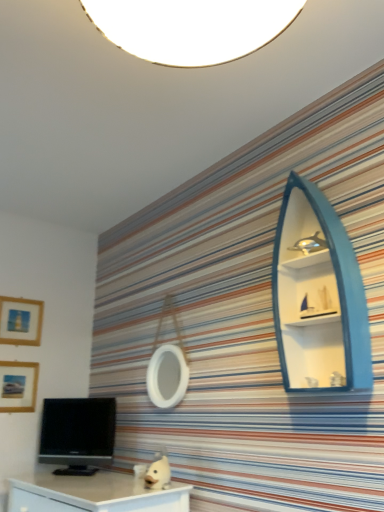
Question: Does wooden matte picture frame at lower left, the 1th picture frame when ordered from bottom to top, touch black glossy tv at lower left?

Choices:
 (A) yes
 (B) no

Answer: (B)

Question: From a real-world perspective, is wooden matte picture frame at lower left, which ranks as the 2th picture frame in top-to-bottom order, physically below black glossy tv at lower left?

Choices:
 (A) no
 (B) yes

Answer: (A)

Question: Is the depth of wooden matte picture frame at lower left, the 1th picture frame when ordered from bottom to top, less than that of black glossy tv at lower left?

Choices:
 (A) no
 (B) yes

Answer: (A)

Question: Is wooden matte picture frame at lower left, the 1th picture frame when ordered from bottom to top, behind black glossy tv at lower left?

Choices:
 (A) yes
 (B) no

Answer: (A)

Question: From a real-world perspective, is wooden matte picture frame at lower left, the 1th picture frame when ordered from bottom to top, on top of black glossy tv at lower left?

Choices:
 (A) no
 (B) yes

Answer: (B)

Question: Considering the relative positions of wooden matte picture frame at lower left, which ranks as the 2th picture frame in top-to-bottom order, and black glossy tv at lower left in the image provided, is wooden matte picture frame at lower left, which ranks as the 2th picture frame in top-to-bottom order, to the left of black glossy tv at lower left from the viewer's perspective?

Choices:
 (A) yes
 (B) no

Answer: (A)

Question: Is black glossy tv at lower left positioned with its back to wooden matte picture frame at lower left, which ranks as the 2th picture frame in top-to-bottom order?

Choices:
 (A) yes
 (B) no

Answer: (B)

Question: Is black glossy tv at lower left thinner than wooden matte picture frame at lower left, the 1th picture frame when ordered from bottom to top?

Choices:
 (A) no
 (B) yes

Answer: (A)

Question: From a real-world perspective, is black glossy tv at lower left on top of wooden matte picture frame at lower left, the 1th picture frame when ordered from bottom to top?

Choices:
 (A) no
 (B) yes

Answer: (A)

Question: Does black glossy tv at lower left have a lesser height compared to wooden matte picture frame at lower left, which ranks as the 2th picture frame in top-to-bottom order?

Choices:
 (A) no
 (B) yes

Answer: (A)

Question: Does black glossy tv at lower left appear on the left side of wooden matte picture frame at lower left, which ranks as the 2th picture frame in top-to-bottom order?

Choices:
 (A) no
 (B) yes

Answer: (A)

Question: Considering the relative sizes of black glossy tv at lower left and wooden matte picture frame at lower left, which ranks as the 2th picture frame in top-to-bottom order, in the image provided, is black glossy tv at lower left bigger than wooden matte picture frame at lower left, which ranks as the 2th picture frame in top-to-bottom order,?

Choices:
 (A) yes
 (B) no

Answer: (A)

Question: Are teal wood boat-shaped shelf at upper right and black glossy tv at lower left far apart?

Choices:
 (A) no
 (B) yes

Answer: (B)